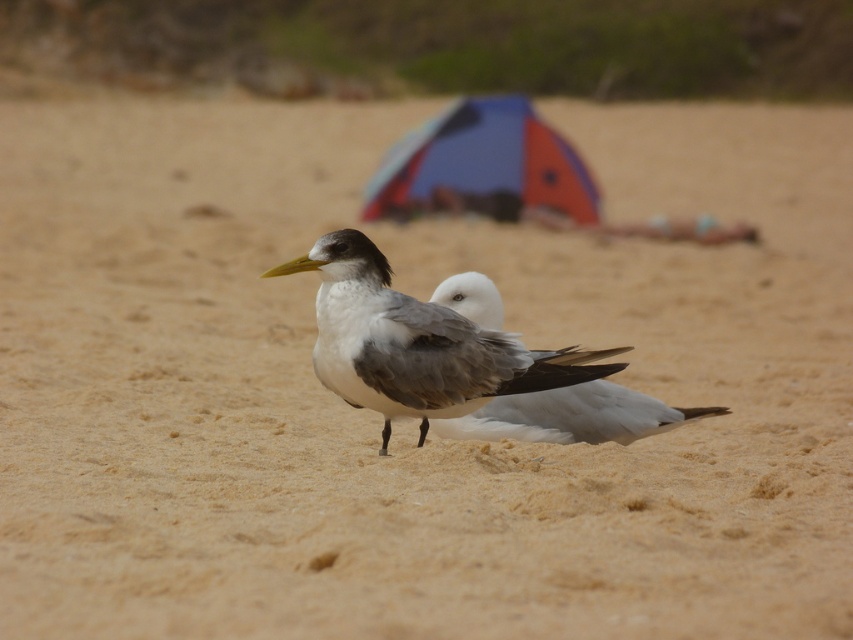
Is point (582, 212) less distant than point (479, 282)?

No, (582, 212) is behind (479, 282).

Is point (421, 131) farther from viewer compared to point (523, 403)?

Yes.

Find the location of `blue fabric tent at center`. blue fabric tent at center is located at coordinates (483, 161).

Who is more distant from viewer, (x=345, y=339) or (x=544, y=192)?

Positioned behind is point (x=544, y=192).

Where is `gray matte gull at center`? The height and width of the screenshot is (640, 853). gray matte gull at center is located at coordinates (416, 342).

Is gray matte gull at center in front of white matte bird at center?

A: Yes, it is.

Is gray matte gull at center smaller than white matte bird at center?

No.

Identify the location of gray matte gull at center. The height and width of the screenshot is (640, 853). (416, 342).

Image resolution: width=853 pixels, height=640 pixels. I want to click on gray matte gull at center, so click(416, 342).